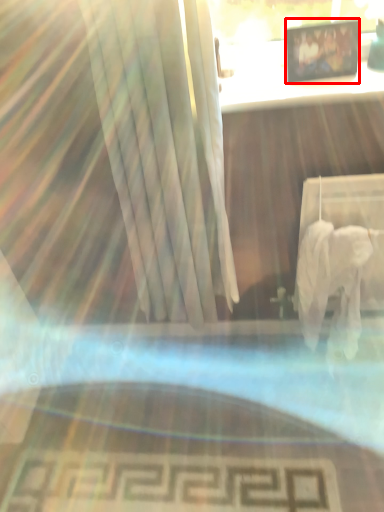
Question: From the image's perspective, what is the correct spatial positioning of picture frame (annotated by the red box) in reference to table?

Choices:
 (A) above
 (B) below

Answer: (A)